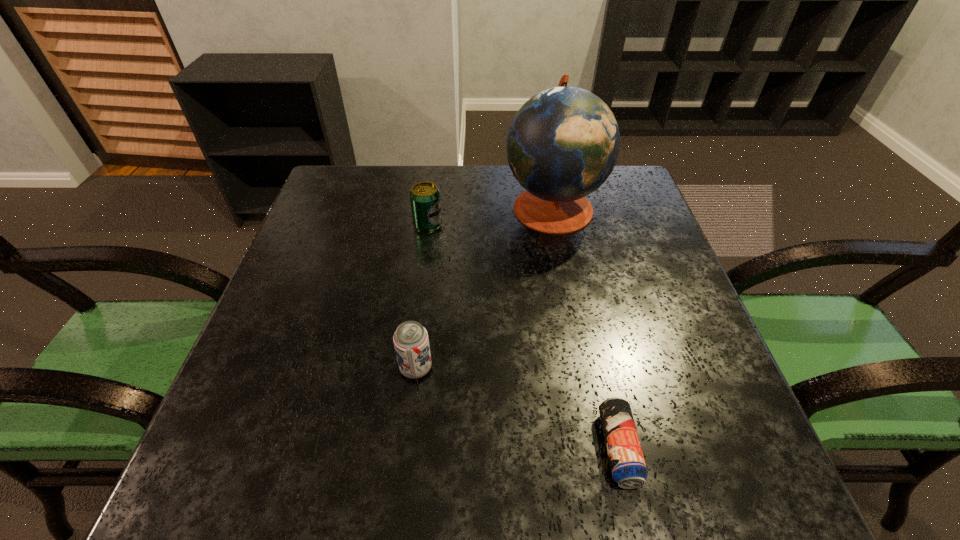
Identify the location of vacant area that lies between the farthest beer can and the rightmost beer can. The width and height of the screenshot is (960, 540). (523, 336).

At what (x,y) coordinates should I click in order to perform the action: click on object that is the second nearest to the second farthest beer can. Please return your answer as a coordinate pair (x, y). Looking at the image, I should click on (425, 200).

Select which object is the second closest to the nearest beer can. Please provide its 2D coordinates. Your answer should be formatted as a tuple, i.e. [(x, y)], where the tuple contains the x and y coordinates of a point satisfying the conditions above.

[(563, 143)]

Point out which beer can is positioned as the nearest to the farthest beer can. Please provide its 2D coordinates. Your answer should be formatted as a tuple, i.e. [(x, y)], where the tuple contains the x and y coordinates of a point satisfying the conditions above.

[(411, 342)]

The image size is (960, 540). I want to click on beer can that stands as the third closest to the tallest object, so [627, 463].

Identify the location of blank space that satisfies the following two spatial constraints: 1. with the Americas facing the viewer on the tallest object; 2. on the left side of the rightmost beer can. (600, 448).